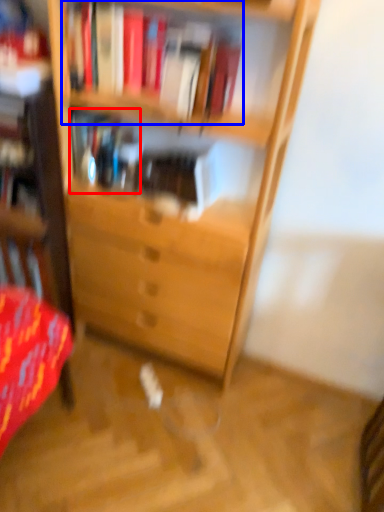
Question: Which point is closer to the camera, book (highlighted by a red box) or book (highlighted by a blue box)?

Choices:
 (A) book
 (B) book

Answer: (B)